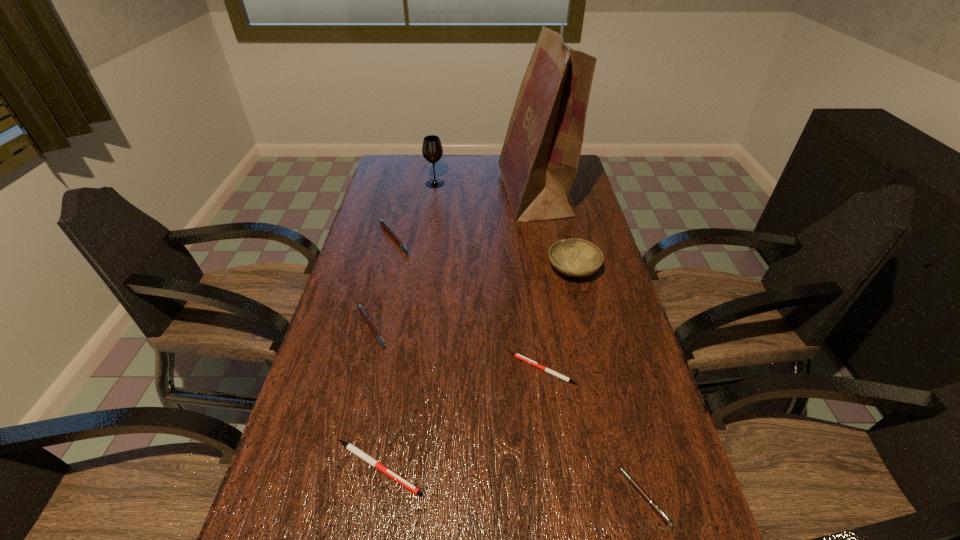
Identify the location of vacant space that's between the seventh shortest object and the nearest pink pen. Image resolution: width=960 pixels, height=540 pixels. (540, 340).

Identify the location of unoccupied position between the third tallest object and the gray wineglass. (504, 227).

Image resolution: width=960 pixels, height=540 pixels. What are the coordinates of `empty space between the fourth tallest object and the fourth pen from left to right` in the screenshot? It's located at (469, 305).

The width and height of the screenshot is (960, 540). What are the coordinates of `free space between the fifth shortest object and the second tallest object` in the screenshot? It's located at tap(415, 211).

Find the location of a particular element. The width and height of the screenshot is (960, 540). object that is the third closest to the fourth nearest pen is located at coordinates (517, 355).

Where is `object that is the fourth closest to the rightmost pink pen`? object that is the fourth closest to the rightmost pink pen is located at coordinates (364, 314).

Identify which pen is the second nearest to the grocery bag. Please provide its 2D coordinates. Your answer should be formatted as a tuple, i.e. [(x, y)], where the tuple contains the x and y coordinates of a point satisfying the conditions above.

[(364, 314)]

The image size is (960, 540). Find the location of `the second closest pen to the second nearest pink pen`. the second closest pen to the second nearest pink pen is located at coordinates (349, 446).

The height and width of the screenshot is (540, 960). In order to click on the closest pink pen to the grocery bag in this screenshot , I will do `click(387, 228)`.

The width and height of the screenshot is (960, 540). Identify the location of pink pen that stands as the closest to the grocery bag. (387, 228).